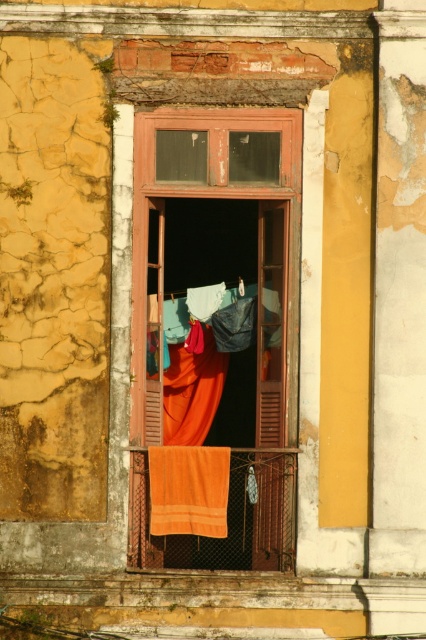
Question: Is wooden window at center thinner than orange towel at lower center?

Choices:
 (A) yes
 (B) no

Answer: (A)

Question: Which of the following is the closest to the observer?

Choices:
 (A) wooden window at center
 (B) orange fabric curtain at center

Answer: (A)

Question: Does wooden window at center come in front of orange fabric curtain at center?

Choices:
 (A) yes
 (B) no

Answer: (A)

Question: Does wooden window at center lie behind orange towel at lower center?

Choices:
 (A) yes
 (B) no

Answer: (A)

Question: Considering the real-world distances, which object is closest to the orange towel at lower center?

Choices:
 (A) wooden window at center
 (B) orange fabric curtain at center

Answer: (B)

Question: Which object is farther from the camera taking this photo?

Choices:
 (A) orange towel at lower center
 (B) orange fabric curtain at center
 (C) wooden window at center

Answer: (B)